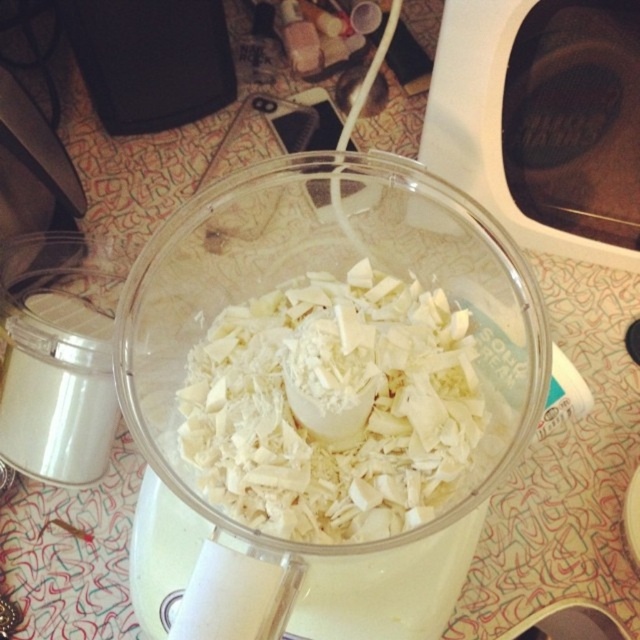
Question: Which point appears farthest from the camera in this image?

Choices:
 (A) (499, 312)
 (B) (218, 454)

Answer: (A)

Question: Does transparent plastic bowl at center have a greater width compared to white shredded coconut at center?

Choices:
 (A) yes
 (B) no

Answer: (A)

Question: Which point is farther to the camera?

Choices:
 (A) (227, 266)
 (B) (333, 344)

Answer: (A)

Question: Does transparent plastic bowl at center have a smaller size compared to white shredded coconut at center?

Choices:
 (A) yes
 (B) no

Answer: (B)

Question: Can you confirm if transparent plastic bowl at center is thinner than white shredded coconut at center?

Choices:
 (A) no
 (B) yes

Answer: (A)

Question: Which point is farther from the camera taking this photo?

Choices:
 (A) (436, 342)
 (B) (129, 273)

Answer: (A)